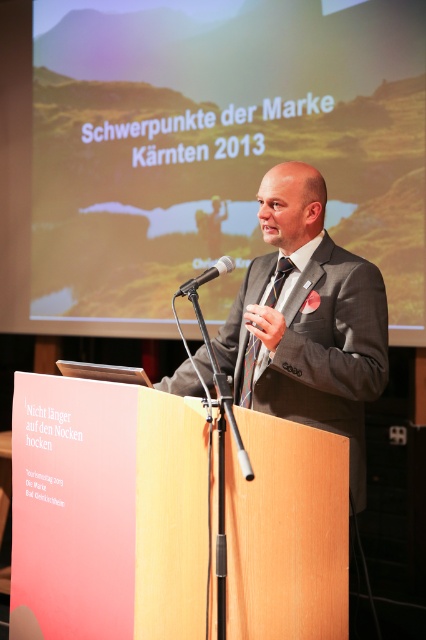
Question: From the image, what is the correct spatial relationship of matte black suit at center in relation to black plastic microphone at center?

Choices:
 (A) below
 (B) above

Answer: (A)

Question: Among these objects, which one is farthest from the camera?

Choices:
 (A) black plastic microphone at center
 (B) matte black suit at center

Answer: (B)

Question: Can you confirm if matte black suit at center is positioned below black plastic microphone at center?

Choices:
 (A) yes
 (B) no

Answer: (A)

Question: Does matte black suit at center appear under black plastic microphone at center?

Choices:
 (A) no
 (B) yes

Answer: (B)

Question: Which point is farther to the camera?

Choices:
 (A) matte black suit at center
 (B) black plastic microphone at center

Answer: (A)